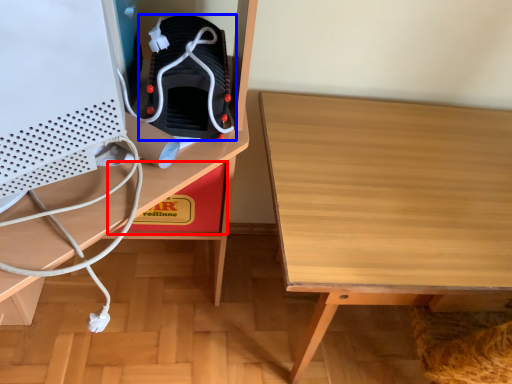
Question: Among these objects, which one is farthest to the camera, cardboard box (highlighted by a red box) or footwear (highlighted by a blue box)?

Choices:
 (A) cardboard box
 (B) footwear

Answer: (A)